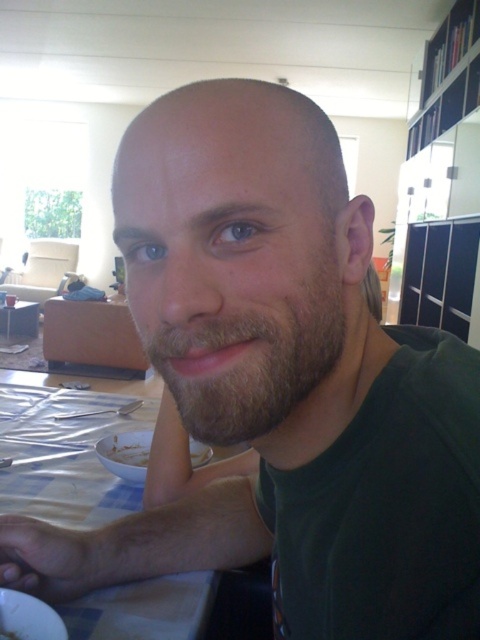
You are a delivery robot with a 2.5 meter long package. You need to move from the wooden table at center to the white matte plate at lower left. Can you navigate the space between them without tilting the package?

The distance between the wooden table at center and the white matte plate at lower left is 4.62 meters, which is longer than the package length of 2.5 meters. Therefore, the robot can navigate the space between them without tilting the package.

You are a photographer setting up for a portrait. You want to ensure that both the white checkered tablecloth at lower left and the brown fuzzy beard at center are clearly visible in the frame. Given their sizes, which object should you focus on to ensure both are in focus?

The white checkered tablecloth at lower left is larger than the brown fuzzy beard at center. To ensure both are in focus, you should focus on the brown fuzzy beard at center since it is smaller and closer to the camera, allowing the larger tablecloth to stay within the depth of field.

You are standing in the dining area and want to place a 16 feet long tablecloth on the wooden table at center. Can you determine if the tablecloth will fit the table?

The wooden table at center is 16.26 feet away from camera. The distance from the camera does not indicate the table size. Therefore, it is impossible to determine if the tablecloth will fit based on the provided information.